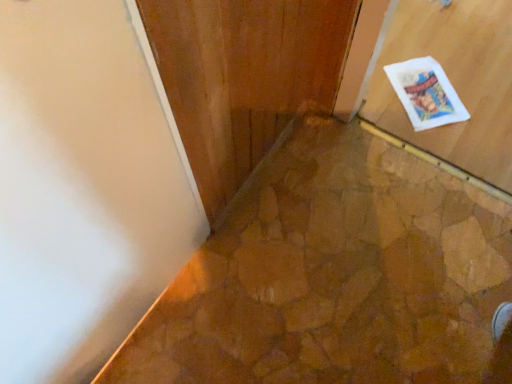
Question: From the image's perspective, is white paper postcard at upper right beneath matte wood door at upper right?

Choices:
 (A) yes
 (B) no

Answer: (B)

Question: Is white paper postcard at upper right in contact with matte wood door at upper right?

Choices:
 (A) yes
 (B) no

Answer: (B)

Question: Can you confirm if white paper postcard at upper right is thinner than matte wood door at upper right?

Choices:
 (A) no
 (B) yes

Answer: (A)

Question: Is white paper postcard at upper right smaller than matte wood door at upper right?

Choices:
 (A) yes
 (B) no

Answer: (A)

Question: Does white paper postcard at upper right turn towards matte wood door at upper right?

Choices:
 (A) yes
 (B) no

Answer: (B)

Question: From the image's perspective, would you say white paper postcard at upper right is positioned over matte wood door at upper right?

Choices:
 (A) no
 (B) yes

Answer: (B)

Question: Is white paper postcard at upper right surrounded by matte wood door at upper right?

Choices:
 (A) yes
 (B) no

Answer: (B)

Question: Is matte wood door at upper right far from white paper postcard at upper right?

Choices:
 (A) no
 (B) yes

Answer: (B)

Question: Is matte wood door at upper right taller than white paper postcard at upper right?

Choices:
 (A) yes
 (B) no

Answer: (A)

Question: From the image's perspective, is matte wood door at upper right on top of white paper postcard at upper right?

Choices:
 (A) yes
 (B) no

Answer: (B)

Question: Can you confirm if matte wood door at upper right is positioned to the right of white paper postcard at upper right?

Choices:
 (A) yes
 (B) no

Answer: (B)

Question: Is the position of matte wood door at upper right less distant than that of white paper postcard at upper right?

Choices:
 (A) yes
 (B) no

Answer: (A)

Question: Visually, is matte wood door at upper right positioned to the left or to the right of white paper postcard at upper right?

Choices:
 (A) left
 (B) right

Answer: (A)